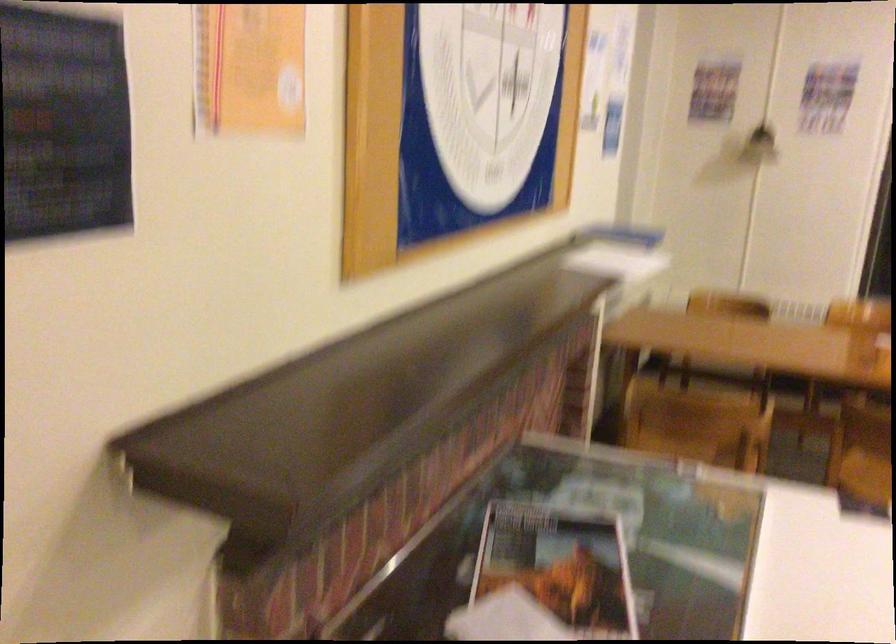
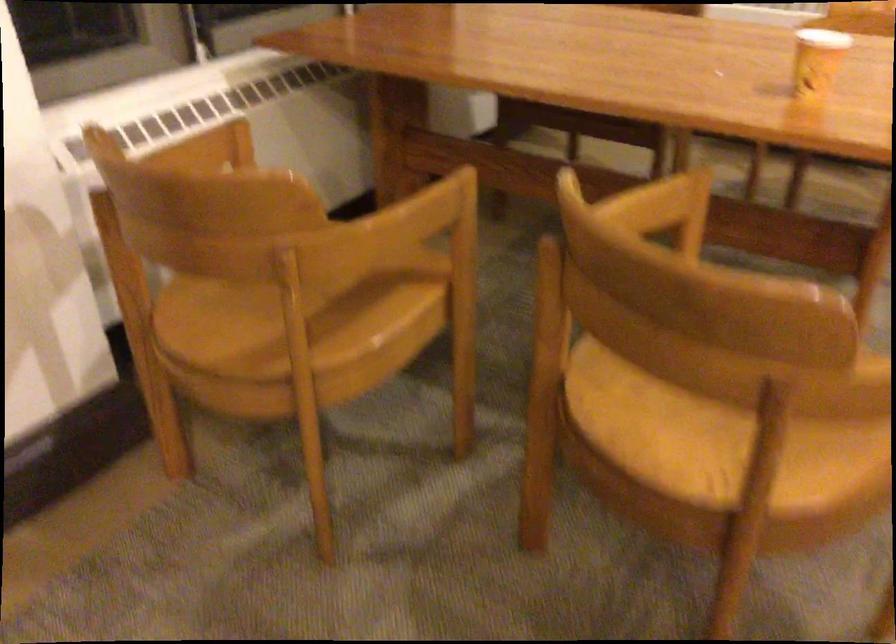
The images are taken continuously from a first-person perspective. In which direction are you moving?

The movement direction of the cameraman is right, forward.